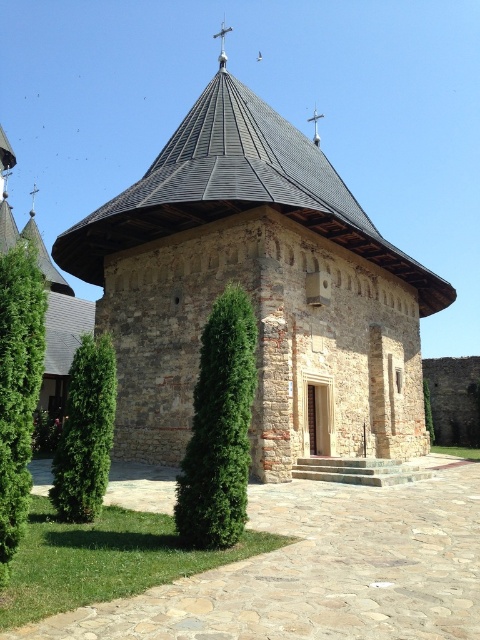
You are a tourist standing in front of the brown stone church at lower left and want to visit the brown stone chapel at center. Which direction should you walk to reach the chapel?

The brown stone chapel at center is smaller than the brown stone church at lower left. Since the chapel is at the center and the church is at the lower left, you should walk towards the center from the lower left position to reach the chapel.

You are standing in front of the brown stone chapel at center and want to walk towards the brown stone church at lower left. Which direction should you move to reach it?

The brown stone chapel at center is positioned over the brown stone church at lower left, so you should move downward to reach the brown stone church at lower left.

You are standing at the entrance of the brown stone chapel at center. You want to walk to the point marked as point A located at coordinates 0.456, 0.535. Is the point A inside the chapel?

The position of brown stone chapel at center is at point (256, 291), so point A is exactly at the center of the chapel, meaning it is inside the chapel.